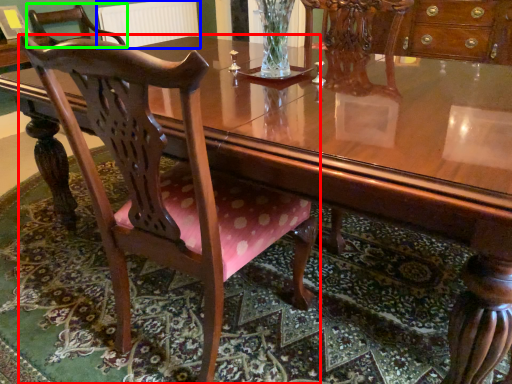
Question: Which object is positioned closest to chair (highlighted by a red box)? Select from radiator (highlighted by a blue box) and chair (highlighted by a green box).

Choices:
 (A) radiator
 (B) chair

Answer: (B)